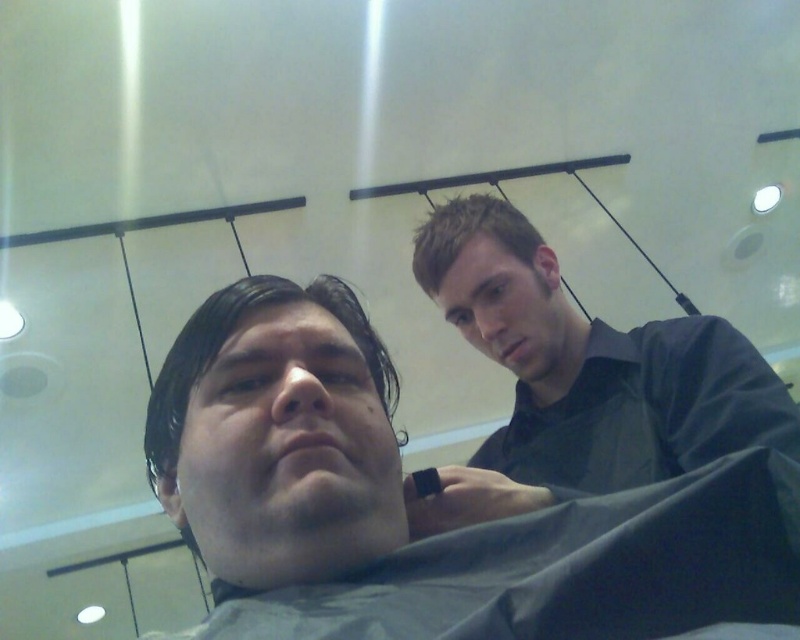
Does point (662, 420) come in front of point (436, 253)?

Yes, point (662, 420) is in front of point (436, 253).

Where is `dark gray shirt at upper right`? This screenshot has height=640, width=800. dark gray shirt at upper right is located at coordinates (580, 378).

Between point (652, 417) and point (620, 486), which one is positioned behind?

The point (652, 417) is more distant.

Between smooth gray shirt at center and dark gray shirt at upper right, which one appears on the left side from the viewer's perspective?

From the viewer's perspective, smooth gray shirt at center appears more on the left side.

Between point (236, 481) and point (660, 374), which one is positioned behind?

Point (660, 374)

The image size is (800, 640). In order to click on smooth gray shirt at center in this screenshot , I will do `click(413, 490)`.

Is smooth gray shirt at center below short brown hair at upper center?

Indeed, smooth gray shirt at center is positioned under short brown hair at upper center.

Does smooth gray shirt at center have a lesser width compared to short brown hair at upper center?

In fact, smooth gray shirt at center might be wider than short brown hair at upper center.

Is point (312, 563) positioned after point (458, 221)?

No.

The width and height of the screenshot is (800, 640). Find the location of `smooth gray shirt at center`. smooth gray shirt at center is located at coordinates (413, 490).